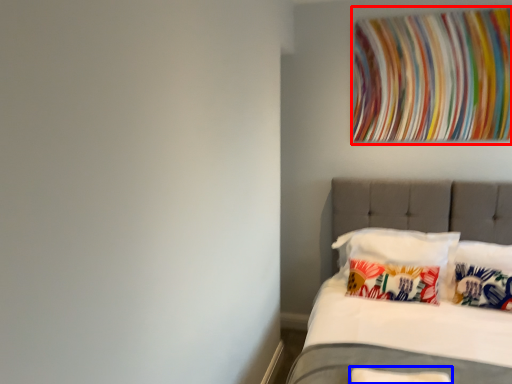
Question: Which object is further to the camera taking this photo, tapestry (highlighted by a red box) or pillow (highlighted by a blue box)?

Choices:
 (A) tapestry
 (B) pillow

Answer: (A)